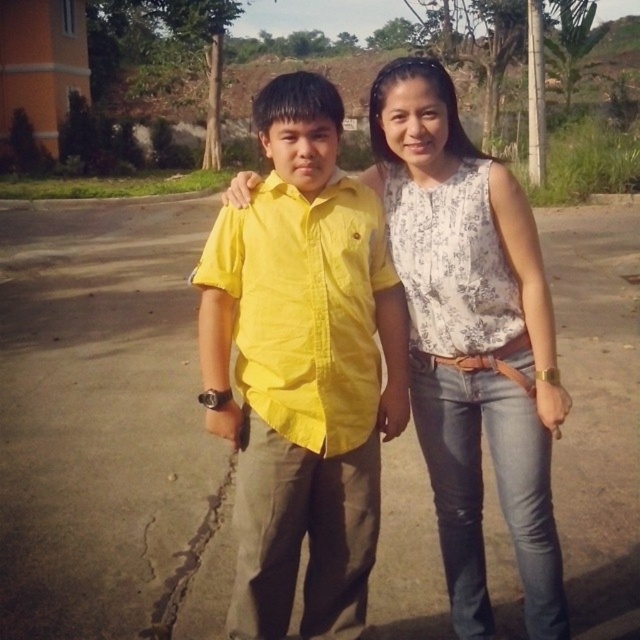
Is yellow cotton shirt at center bigger than white floral blouse at center?

Incorrect, yellow cotton shirt at center is not larger than white floral blouse at center.

Is point (241, 508) positioned before point (465, 438)?

Yes.

This screenshot has width=640, height=640. In order to click on yellow cotton shirt at center in this screenshot , I will do `click(301, 369)`.